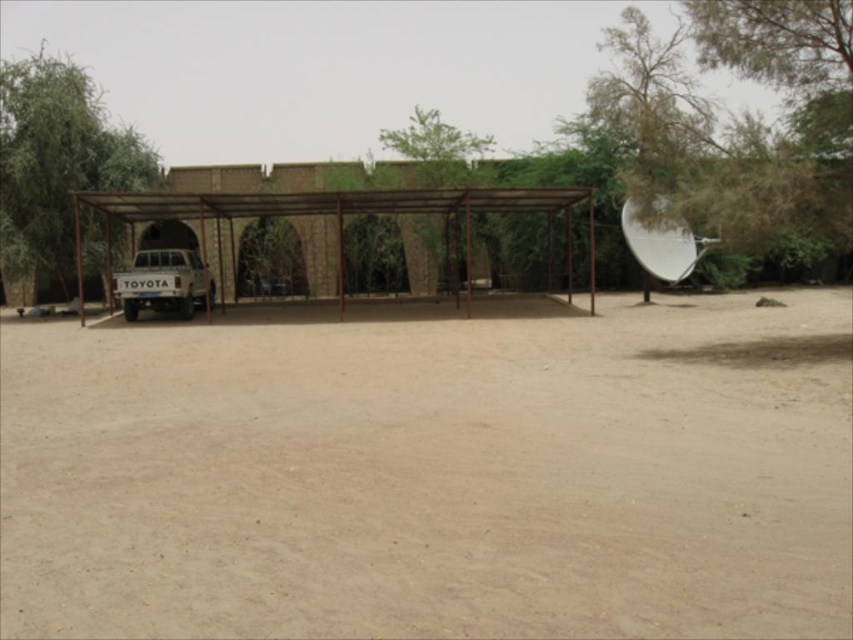
Does green leafy tree at center appear over white matte truck at left?

Yes.

Is green leafy tree at center below white matte truck at left?

No, green leafy tree at center is not below white matte truck at left.

Find the location of a particular element. Image resolution: width=853 pixels, height=640 pixels. green leafy tree at center is located at coordinates (438, 148).

Who is lower down, brown sandy dirt track at center or green leafy tree at center?

brown sandy dirt track at center is lower down.

Does point (801, 424) come farther from viewer compared to point (431, 168)?

No.

Identify the location of brown sandy dirt track at center. (433, 476).

Can you confirm if brown sandy dirt track at center is smaller than white matte truck at left?

Incorrect, brown sandy dirt track at center is not smaller in size than white matte truck at left.

Is point (796, 444) closer to camera compared to point (148, 252)?

Yes.

The height and width of the screenshot is (640, 853). What are the coordinates of `brown sandy dirt track at center` in the screenshot? It's located at (433, 476).